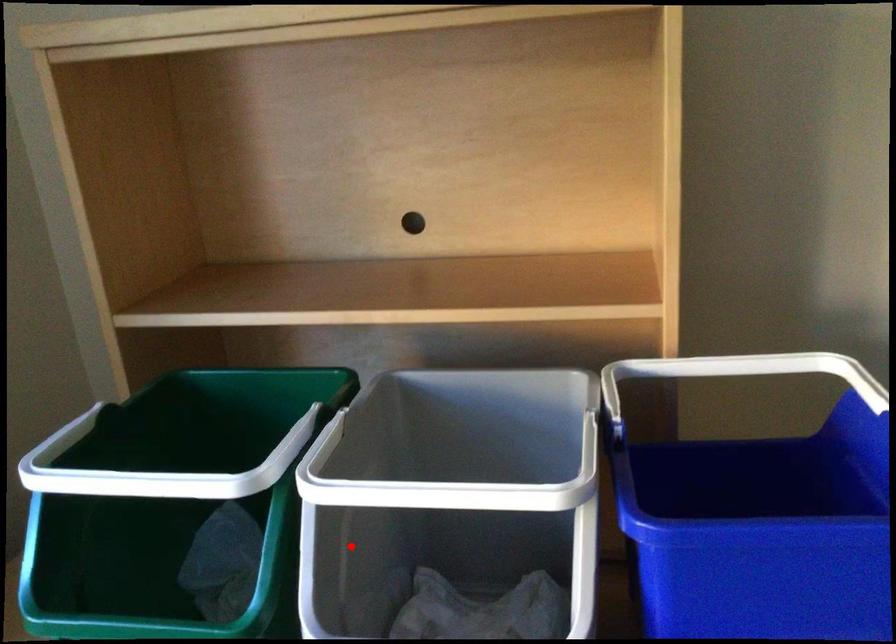
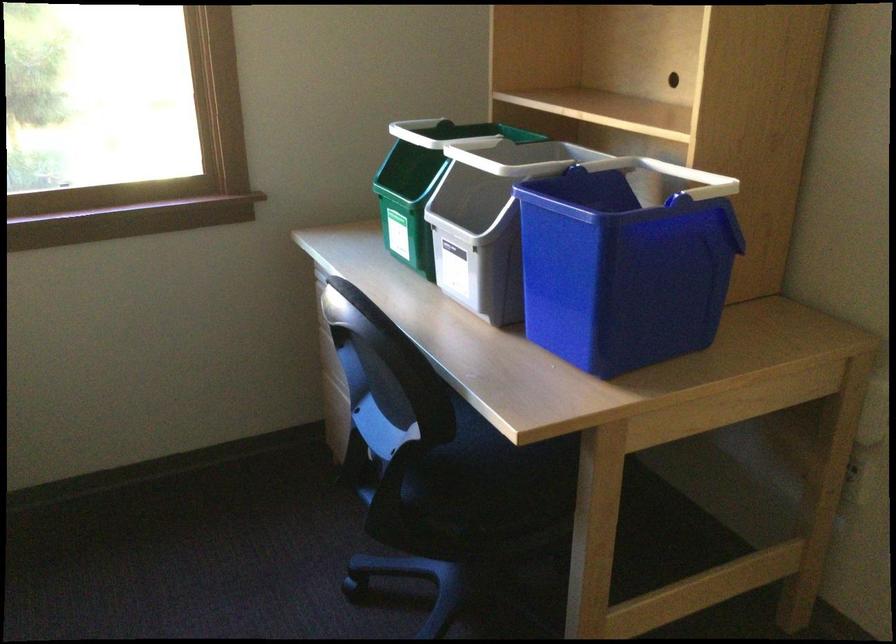
The point at the highlighted location is marked in the first image. Where is the corresponding point in the second image?

(479, 201)